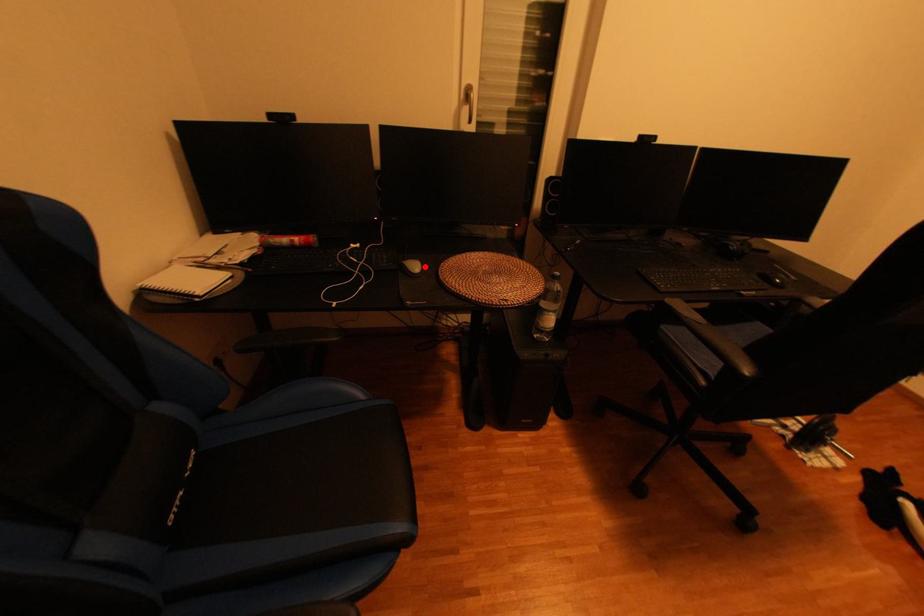
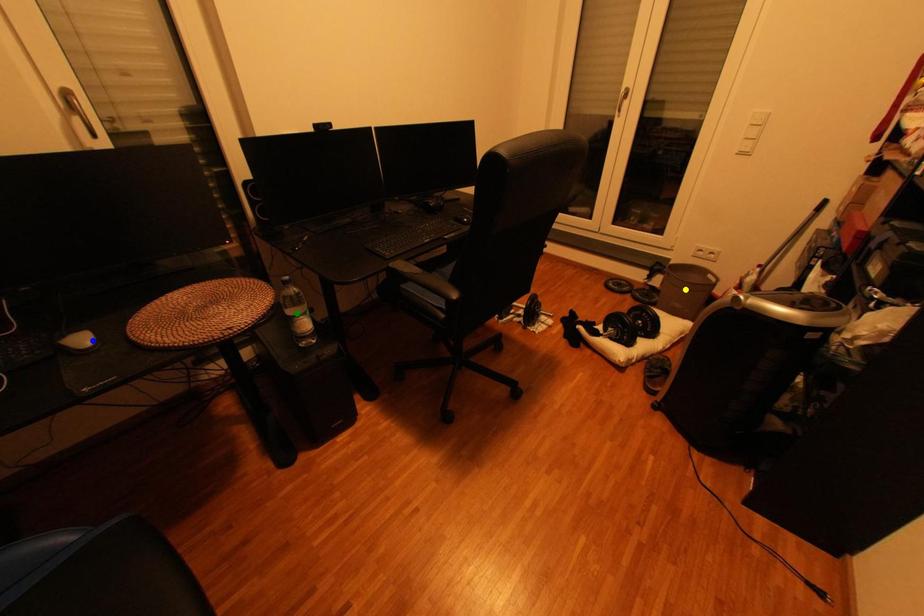
Question: I am providing you with two images of the same scene from different viewpoints. A red point is marked on the first image. You are given multiple points on the second image. Which spot in image 2 lines up with the point in image 1?

Choices:
 (A) yellow point
 (B) green point
 (C) blue point

Answer: (C)